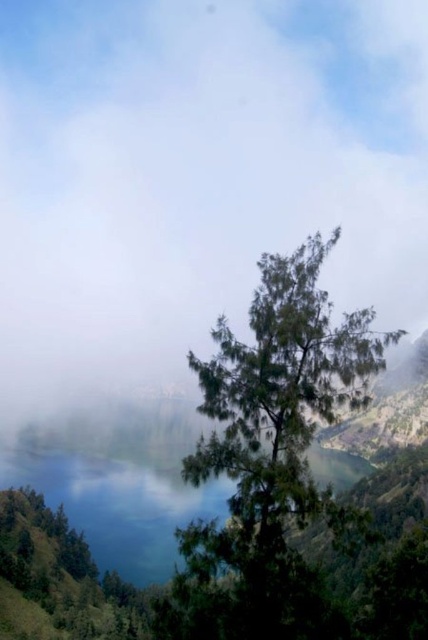
You are an artist trying to paint this scene. You need to decide which object to paint first based on their sizes. Which one should you start with, the white fluffy morning fog at center or the green leafy tree at center?

The white fluffy morning fog at center is larger in size than the green leafy tree at center, so you should start painting the white fluffy morning fog at center first to ensure proper scaling and positioning before detailing the smaller tree.

You are an artist standing in the landscape scene. You want to paint the white fluffy morning fog at center and the green leafy tree at center. Which object is closer to you as you paint?

The white fluffy morning fog at center is closer to you than the green leafy tree at center.

Consider the image. You are a photographer standing at the edge of the lake in the image. You want to capture the white fluffy morning fog at center in your shot. Based on its coordinates, where should you aim your camera?

You should aim your camera at point (196, 179) to capture the white fluffy morning fog at center, as that is its exact location according to the coordinates provided.